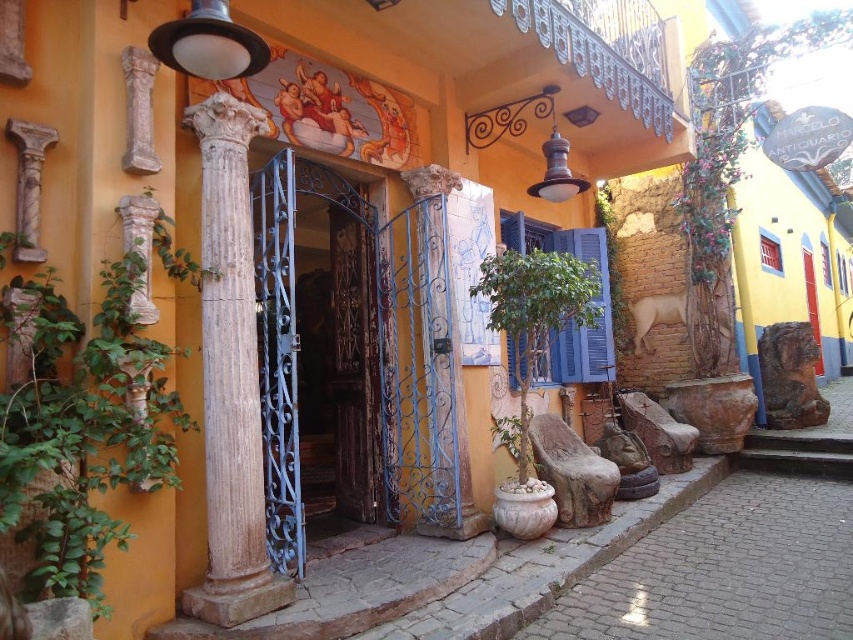
Question: Does green leafy plant at left appear on the right side of green leafy plant at center?

Choices:
 (A) yes
 (B) no

Answer: (B)

Question: Which of the following is the farthest from the observer?

Choices:
 (A) wooden door at center
 (B) green leafy plant at left
 (C) blue wrought iron gate at center

Answer: (A)

Question: Among these points, which one is nearest to the camera?

Choices:
 (A) (198, 67)
 (B) (218, 182)
 (C) (563, 376)
 (D) (534, 276)

Answer: (A)

Question: Is green leafy plant at left wider than blue matte shutter at center?

Choices:
 (A) no
 (B) yes

Answer: (B)

Question: Considering the real-world distances, which object is farthest from the blue wrought iron gate at center?

Choices:
 (A) wooden door at center
 (B) green leafy plant at left
 (C) green leafy plant at center
 (D) matte white lampshade at upper left

Answer: (A)

Question: Can you confirm if green leafy plant at left is bigger than green leafy plant at right?

Choices:
 (A) yes
 (B) no

Answer: (B)